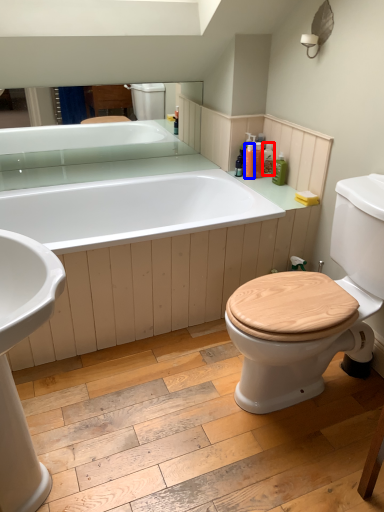
Question: Which object is closer to the camera taking this photo, toiletry (highlighted by a red box) or toiletry (highlighted by a blue box)?

Choices:
 (A) toiletry
 (B) toiletry

Answer: (B)